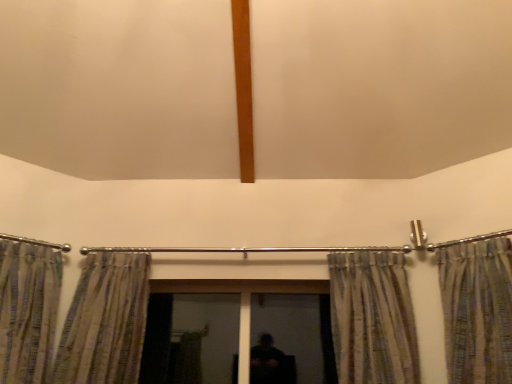
In the scene shown: What is the approximate height of black matte screen door at center, acting as the second screen door starting from the left?

The height of black matte screen door at center, acting as the second screen door starting from the left, is 23.49 inches.

Describe the element at coordinates (291, 330) in the screenshot. This screenshot has height=384, width=512. I see `black matte screen door at center, placed as the 1th screen door when sorted from right to left` at that location.

Describe the element at coordinates (105, 321) in the screenshot. I see `striped fabric curtain at left, the second curtain from the left` at that location.

Measure the distance between transparent glass screen door at center, marked as the first screen door in a left-to-right arrangement, and camera.

The depth of transparent glass screen door at center, marked as the first screen door in a left-to-right arrangement, is 7.76 feet.

What do you see at coordinates (190, 338) in the screenshot? I see `transparent glass screen door at center, marked as the first screen door in a left-to-right arrangement` at bounding box center [190, 338].

What do you see at coordinates (372, 318) in the screenshot?
I see `striped fabric curtain at right, acting as the 2th curtain starting from the right` at bounding box center [372, 318].

This screenshot has height=384, width=512. Identify the location of black matte screen door at center, placed as the 1th screen door when sorted from right to left. (x=291, y=330).

Which object is wider, striped fabric curtain at left, acting as the 4th curtain starting from the right, or metallic striped curtain at right, the fourth curtain viewed from the left?

metallic striped curtain at right, the fourth curtain viewed from the left.

Would you say striped fabric curtain at left, acting as the 4th curtain starting from the right, is outside metallic striped curtain at right, the fourth curtain viewed from the left?

Yes, striped fabric curtain at left, acting as the 4th curtain starting from the right, is located beyond the bounds of metallic striped curtain at right, the fourth curtain viewed from the left.

Considering the relative sizes of striped fabric curtain at left, acting as the 4th curtain starting from the right, and metallic striped curtain at right, the fourth curtain viewed from the left, in the image provided, is striped fabric curtain at left, acting as the 4th curtain starting from the right, smaller than metallic striped curtain at right, the fourth curtain viewed from the left,?

Yes, striped fabric curtain at left, acting as the 4th curtain starting from the right, is smaller than metallic striped curtain at right, the fourth curtain viewed from the left.

How many degrees apart are the facing directions of striped fabric curtain at left, acting as the 4th curtain starting from the right, and metallic striped curtain at right, which is counted as the first curtain, starting from the right?

78.9 degrees.

Is transparent glass screen door at center, the second screen door in the right-to-left sequence, to the left of metallic striped curtain at right, the fourth curtain viewed from the left, from the viewer's perspective?

Indeed, transparent glass screen door at center, the second screen door in the right-to-left sequence, is positioned on the left side of metallic striped curtain at right, the fourth curtain viewed from the left.

Considering the sizes of transparent glass screen door at center, the second screen door in the right-to-left sequence, and metallic striped curtain at right, the fourth curtain viewed from the left, in the image, is transparent glass screen door at center, the second screen door in the right-to-left sequence, taller or shorter than metallic striped curtain at right, the fourth curtain viewed from the left,?

Clearly, transparent glass screen door at center, the second screen door in the right-to-left sequence, is shorter compared to metallic striped curtain at right, the fourth curtain viewed from the left.

Which point is more forward, (202,376) or (510,369)?

Point (510,369)

Can you tell me how much striped fabric curtain at left, the 1th curtain from the left, and black matte screen door at center, placed as the 1th screen door when sorted from right to left, differ in facing direction?

They differ by 34.7 degrees in their facing directions.

Can we say striped fabric curtain at left, acting as the 4th curtain starting from the right, lies outside black matte screen door at center, acting as the second screen door starting from the left?

striped fabric curtain at left, acting as the 4th curtain starting from the right, lies outside black matte screen door at center, acting as the second screen door starting from the left,'s area.

This screenshot has height=384, width=512. I want to click on the 3rd curtain in front when counting from the black matte screen door at center, placed as the 1th screen door when sorted from right to left, so click(x=28, y=309).

Could you tell me if striped fabric curtain at left, the 1th curtain from the left, is turned towards black matte screen door at center, acting as the second screen door starting from the left?

No, striped fabric curtain at left, the 1th curtain from the left, is not aimed at black matte screen door at center, acting as the second screen door starting from the left.

From a real-world perspective, does striped fabric curtain at left, acting as the 4th curtain starting from the right, sit lower than transparent glass screen door at center, the second screen door in the right-to-left sequence?

Actually, striped fabric curtain at left, acting as the 4th curtain starting from the right, is physically above transparent glass screen door at center, the second screen door in the right-to-left sequence, in the real world.

Considering the relative positions of striped fabric curtain at left, acting as the 4th curtain starting from the right, and transparent glass screen door at center, the second screen door in the right-to-left sequence, in the image provided, is striped fabric curtain at left, acting as the 4th curtain starting from the right, to the right of transparent glass screen door at center, the second screen door in the right-to-left sequence, from the viewer's perspective?

Incorrect, striped fabric curtain at left, acting as the 4th curtain starting from the right, is not on the right side of transparent glass screen door at center, the second screen door in the right-to-left sequence.

Is striped fabric curtain at left, the 1th curtain from the left, outside of transparent glass screen door at center, the second screen door in the right-to-left sequence?

striped fabric curtain at left, the 1th curtain from the left, lies outside transparent glass screen door at center, the second screen door in the right-to-left sequence,'s area.

Does striped fabric curtain at left, the second curtain from the left, have a greater height compared to striped fabric curtain at right, acting as the 2th curtain starting from the right?

Yes, striped fabric curtain at left, the second curtain from the left, is taller than striped fabric curtain at right, acting as the 2th curtain starting from the right.

Between point (106, 358) and point (416, 371), which one is positioned behind?

The point (106, 358) is farther from the camera.

In the image, is striped fabric curtain at left, arranged as the third curtain when viewed from the right, on the left side or the right side of striped fabric curtain at right, marked as the third curtain in a left-to-right arrangement?

In the image, striped fabric curtain at left, arranged as the third curtain when viewed from the right, appears on the left side of striped fabric curtain at right, marked as the third curtain in a left-to-right arrangement.

You are a GUI agent. You are given a task and a screenshot of the screen. Output one action in this format:
    pyautogui.click(x=<x>, y=<y>)
    Task: Click on the 1st curtain counting from the right of the striped fabric curtain at left, the second curtain from the left
    This screenshot has height=384, width=512.
    Given the screenshot: What is the action you would take?
    pyautogui.click(x=372, y=318)

Does metallic striped curtain at right, the fourth curtain viewed from the left, turn towards transparent glass screen door at center, marked as the first screen door in a left-to-right arrangement?

No, metallic striped curtain at right, the fourth curtain viewed from the left, is not oriented towards transparent glass screen door at center, marked as the first screen door in a left-to-right arrangement.

Between metallic striped curtain at right, which is counted as the first curtain, starting from the right, and transparent glass screen door at center, marked as the first screen door in a left-to-right arrangement, which one has smaller size?

transparent glass screen door at center, marked as the first screen door in a left-to-right arrangement.

From the image's perspective, which object appears higher, metallic striped curtain at right, which is counted as the first curtain, starting from the right, or transparent glass screen door at center, marked as the first screen door in a left-to-right arrangement?

metallic striped curtain at right, which is counted as the first curtain, starting from the right.

Where is `screen door that is the 2nd one when counting leftward from the metallic striped curtain at right, which is counted as the first curtain, starting from the right`? The height and width of the screenshot is (384, 512). screen door that is the 2nd one when counting leftward from the metallic striped curtain at right, which is counted as the first curtain, starting from the right is located at coordinates (190, 338).

Is black matte screen door at center, placed as the 1th screen door when sorted from right to left, in front of transparent glass screen door at center, the second screen door in the right-to-left sequence?

Yes, black matte screen door at center, placed as the 1th screen door when sorted from right to left, is closer to the viewer.

From a real-world perspective, is black matte screen door at center, acting as the second screen door starting from the left, physically above transparent glass screen door at center, the second screen door in the right-to-left sequence?

Indeed, from a real-world perspective, black matte screen door at center, acting as the second screen door starting from the left, stands above transparent glass screen door at center, the second screen door in the right-to-left sequence.

Considering the relative sizes of black matte screen door at center, placed as the 1th screen door when sorted from right to left, and transparent glass screen door at center, marked as the first screen door in a left-to-right arrangement, in the image provided, is black matte screen door at center, placed as the 1th screen door when sorted from right to left, shorter than transparent glass screen door at center, marked as the first screen door in a left-to-right arrangement,?

Yes, black matte screen door at center, placed as the 1th screen door when sorted from right to left, is shorter than transparent glass screen door at center, marked as the first screen door in a left-to-right arrangement.

Considering the relative sizes of black matte screen door at center, acting as the second screen door starting from the left, and transparent glass screen door at center, marked as the first screen door in a left-to-right arrangement, in the image provided, is black matte screen door at center, acting as the second screen door starting from the left, thinner than transparent glass screen door at center, marked as the first screen door in a left-to-right arrangement,?

No.

Locate an element on the screen. The height and width of the screenshot is (384, 512). the 1st curtain positioned below the metallic striped curtain at right, the fourth curtain viewed from the left (from the image's perspective) is located at coordinates (28, 309).

At what (x,y) coordinates should I click in order to perform the action: click on the 2nd screen door located beneath the metallic striped curtain at right, which is counted as the first curtain, starting from the right (from a real-world perspective). Please return your answer as a coordinate pair (x, y). Looking at the image, I should click on tap(190, 338).

Looking at the image, which one is located closer to striped fabric curtain at right, marked as the third curtain in a left-to-right arrangement, striped fabric curtain at left, arranged as the third curtain when viewed from the right, or metallic striped curtain at right, the fourth curtain viewed from the left?

metallic striped curtain at right, the fourth curtain viewed from the left.

From the image, which object appears to be nearer to metallic striped curtain at right, which is counted as the first curtain, starting from the right, black matte screen door at center, acting as the second screen door starting from the left, or striped fabric curtain at right, marked as the third curtain in a left-to-right arrangement?

striped fabric curtain at right, marked as the third curtain in a left-to-right arrangement, is closer to metallic striped curtain at right, which is counted as the first curtain, starting from the right.

From the picture: Considering their positions, is transparent glass screen door at center, marked as the first screen door in a left-to-right arrangement, positioned further to striped fabric curtain at left, the 1th curtain from the left, than striped fabric curtain at left, arranged as the third curtain when viewed from the right?

Based on the image, transparent glass screen door at center, marked as the first screen door in a left-to-right arrangement, appears to be further to striped fabric curtain at left, the 1th curtain from the left.

Based on their spatial positions, is striped fabric curtain at left, the second curtain from the left, or black matte screen door at center, placed as the 1th screen door when sorted from right to left, closer to transparent glass screen door at center, the second screen door in the right-to-left sequence?

striped fabric curtain at left, the second curtain from the left, is closer to transparent glass screen door at center, the second screen door in the right-to-left sequence.

Consider the image. Looking at the image, which one is located closer to black matte screen door at center, acting as the second screen door starting from the left, transparent glass screen door at center, the second screen door in the right-to-left sequence, or striped fabric curtain at left, the second curtain from the left?

transparent glass screen door at center, the second screen door in the right-to-left sequence, lies closer to black matte screen door at center, acting as the second screen door starting from the left, than the other object.

Looking at the image, which one is located closer to striped fabric curtain at left, acting as the 4th curtain starting from the right, transparent glass screen door at center, the second screen door in the right-to-left sequence, or black matte screen door at center, acting as the second screen door starting from the left?

transparent glass screen door at center, the second screen door in the right-to-left sequence, is positioned closer to the anchor striped fabric curtain at left, acting as the 4th curtain starting from the right.

When comparing their distances from striped fabric curtain at left, the second curtain from the left, does metallic striped curtain at right, the fourth curtain viewed from the left, or striped fabric curtain at left, acting as the 4th curtain starting from the right, seem closer?

Among the two, striped fabric curtain at left, acting as the 4th curtain starting from the right, is located nearer to striped fabric curtain at left, the second curtain from the left.

When comparing their distances from striped fabric curtain at left, the second curtain from the left, does striped fabric curtain at left, the 1th curtain from the left, or striped fabric curtain at right, acting as the 2th curtain starting from the right, seem closer?

striped fabric curtain at left, the 1th curtain from the left, is positioned closer to the anchor striped fabric curtain at left, the second curtain from the left.

Locate an element on the screen. curtain between transparent glass screen door at center, marked as the first screen door in a left-to-right arrangement, and metallic striped curtain at right, the fourth curtain viewed from the left, from left to right is located at coordinates tap(372, 318).

The image size is (512, 384). I want to click on curtain between striped fabric curtain at left, acting as the 4th curtain starting from the right, and striped fabric curtain at right, marked as the third curtain in a left-to-right arrangement, so click(x=105, y=321).

Find the location of a particular element. curtain between black matte screen door at center, acting as the second screen door starting from the left, and metallic striped curtain at right, which is counted as the first curtain, starting from the right, in the horizontal direction is located at coordinates (372, 318).

The width and height of the screenshot is (512, 384). Identify the location of curtain located between striped fabric curtain at left, the 1th curtain from the left, and transparent glass screen door at center, marked as the first screen door in a left-to-right arrangement, in the left-right direction. (105, 321).